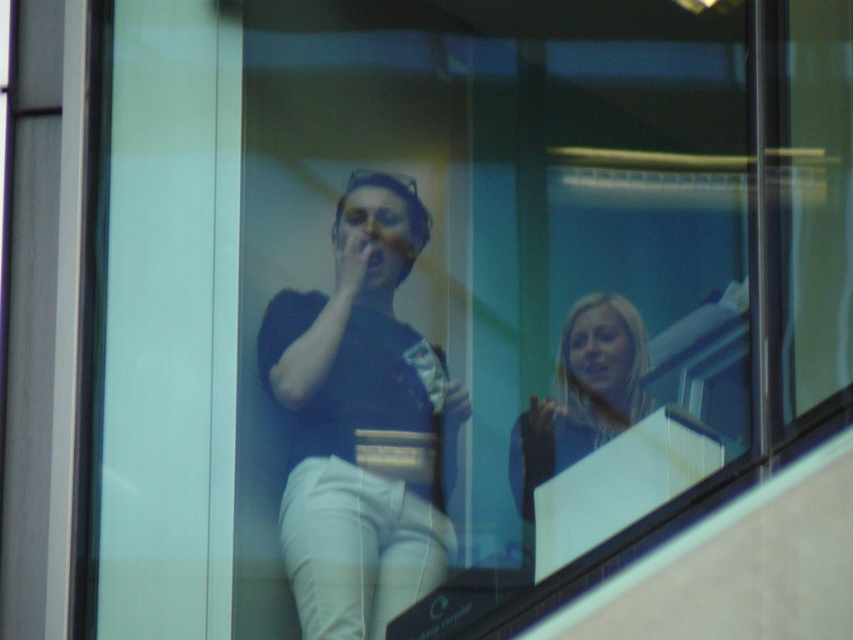
Does matte black shirt at center lie in front of blonde hair at center?

Yes.

Can you confirm if matte black shirt at center is smaller than blonde hair at center?

No.

Describe the element at coordinates (363, 422) in the screenshot. I see `matte black shirt at center` at that location.

I want to click on matte black shirt at center, so click(x=363, y=422).